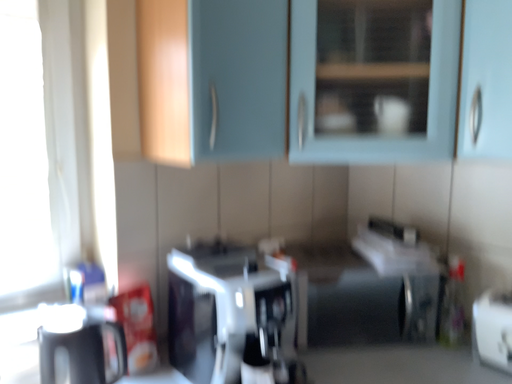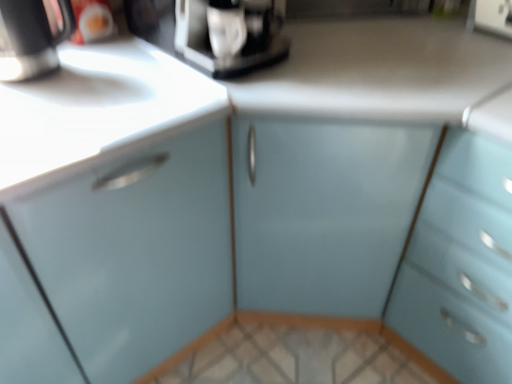
Question: How did the camera likely rotate when shooting the video?

Choices:
 (A) rotated upward
 (B) rotated downward

Answer: (B)